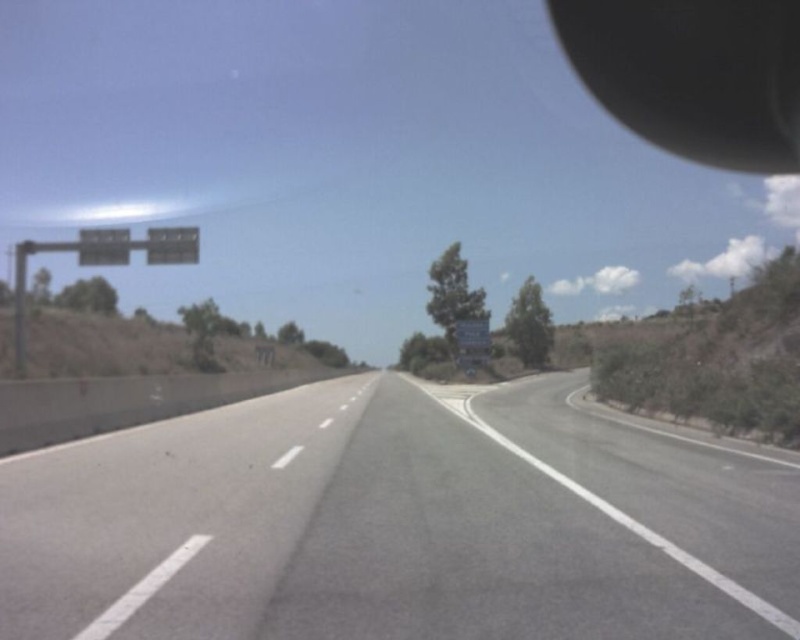
Is black matte view mirror at upper right closer to the viewer compared to white plastic sign at upper left?

No, black matte view mirror at upper right is further to the viewer.

Who is shorter, black matte view mirror at upper right or white plastic sign at upper left?

With less height is white plastic sign at upper left.

Locate an element on the screen. This screenshot has height=640, width=800. black matte view mirror at upper right is located at coordinates (694, 74).

Where is `black matte view mirror at upper right`? This screenshot has height=640, width=800. black matte view mirror at upper right is located at coordinates pyautogui.click(x=694, y=74).

Can you confirm if gray asphalt highway at center is smaller than black matte view mirror at upper right?

Indeed, gray asphalt highway at center has a smaller size compared to black matte view mirror at upper right.

Image resolution: width=800 pixels, height=640 pixels. Describe the element at coordinates (400, 522) in the screenshot. I see `gray asphalt highway at center` at that location.

Measure the distance between gray asphalt highway at center and camera.

They are 5.04 meters apart.

The height and width of the screenshot is (640, 800). Identify the location of gray asphalt highway at center. (400, 522).

Does black matte view mirror at upper right appear on the left side of metallic gray sign at upper center?

No, black matte view mirror at upper right is not to the left of metallic gray sign at upper center.

Image resolution: width=800 pixels, height=640 pixels. I want to click on black matte view mirror at upper right, so click(x=694, y=74).

You are a GUI agent. You are given a task and a screenshot of the screen. Output one action in this format:
    pyautogui.click(x=<x>, y=<y>)
    Task: Click on the black matte view mirror at upper right
    
    Given the screenshot: What is the action you would take?
    pyautogui.click(x=694, y=74)

The image size is (800, 640). In order to click on black matte view mirror at upper right in this screenshot , I will do pyautogui.click(x=694, y=74).